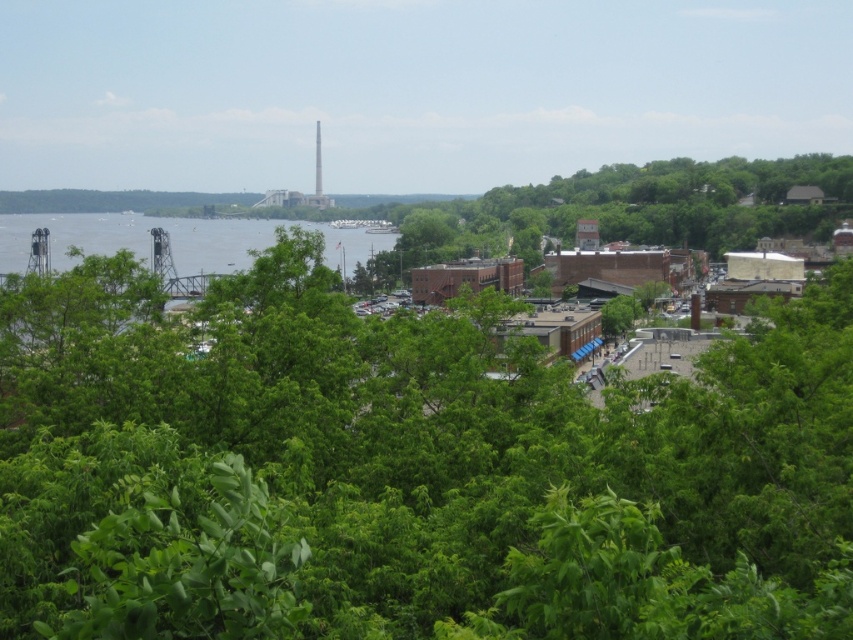
You are a tourist visiting the town and want to take a photo that includes both the green water at left and the white concrete tower at upper center. Given that your camera can only focus on objects within a 100m range, can you confirm if both objects are within the camera range?

The green water at left has a larger size compared to white concrete tower at upper center, but this does not indicate their distance. Without specific distance information, it is impossible to determine if both are within the 100m range.

You are a photographer planning to capture a sunset shot from this vantage point. You want the white concrete tower at upper center to frame the sun while ensuring the green leafy tree at center doesn not block the view. Is this possible given their positions?

The green leafy tree at center is positioned under the white concrete tower at upper center, so the tower is above the tree. This means the tree won t block the tower s view, allowing you to frame the sunset through the tower while keeping the tree below in the composition.